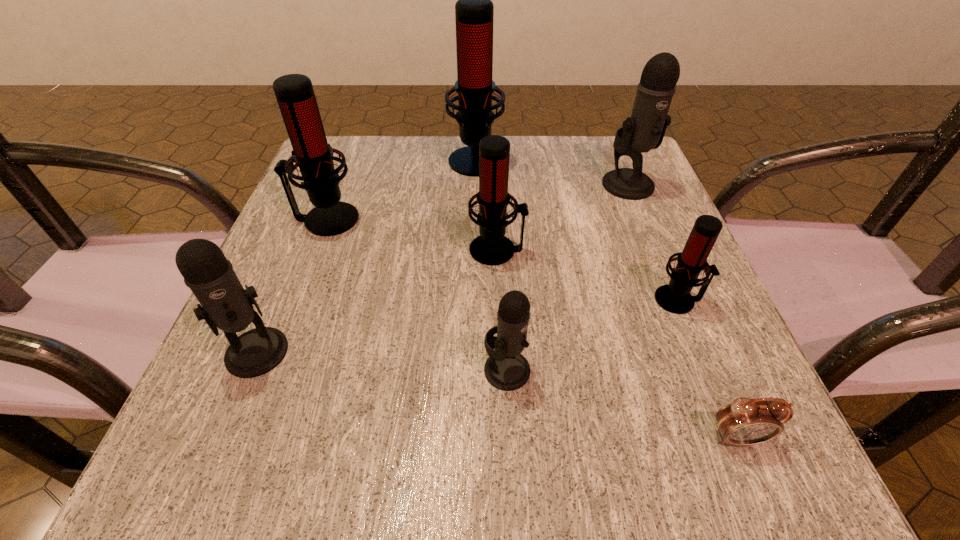
Locate an element on the screen. The image size is (960, 540). the closest red microphone relative to the farthest red microphone is located at coordinates (295, 95).

Identify which red microphone is the second closest to the fifth farthest object. Please provide its 2D coordinates. Your answer should be formatted as a tuple, i.e. [(x, y)], where the tuple contains the x and y coordinates of a point satisfying the conditions above.

[(474, 11)]

Identify the location of the second closest black microphone to the tallest microphone. The image size is (960, 540). (x=506, y=369).

Where is `black microphone object that ranks as the third closest to the third smallest red microphone`? black microphone object that ranks as the third closest to the third smallest red microphone is located at coordinates [x=645, y=129].

Locate an element on the screen. Image resolution: width=960 pixels, height=540 pixels. free region that satisfies the following two spatial constraints: 1. on the front side of the biggest black microphone; 2. on the right side of the nearest red microphone is located at coordinates pyautogui.click(x=674, y=300).

At what (x,y) coordinates should I click in order to perform the action: click on free region that satisfies the following two spatial constraints: 1. on the front side of the smallest black microphone; 2. on the left side of the tallest object. Please return your answer as a coordinate pair (x, y). This screenshot has width=960, height=540. Looking at the image, I should click on (473, 370).

Identify the location of vacant space that satisfies the following two spatial constraints: 1. on the front side of the third biggest red microphone; 2. on the right side of the tallest object. (474, 249).